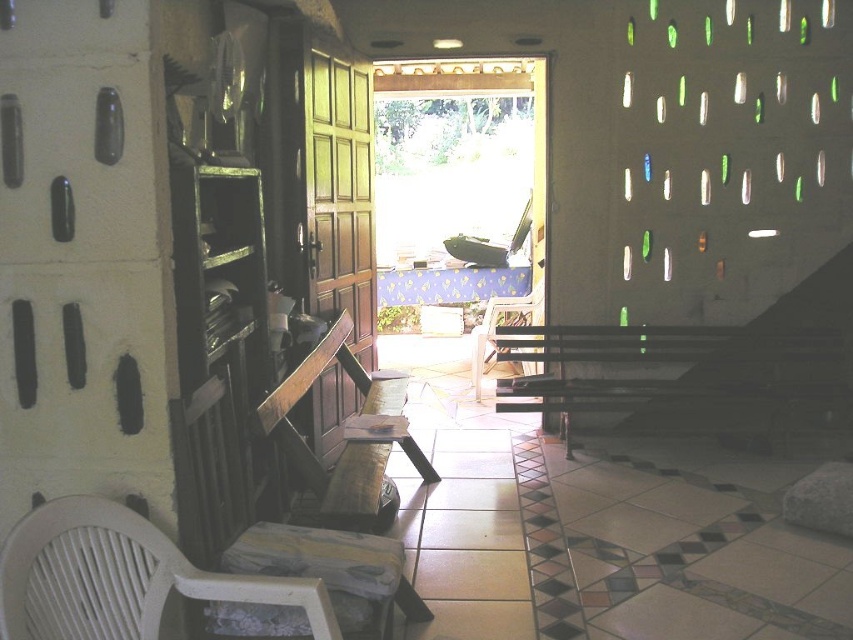
You are standing at the entrance of the room and want to sit on the wooden bench at center. Based on the coordinates provided, is the bench closer to the left wall or the right wall?

The wooden bench at center is located at point 0.683 on the x and y axis, which places it closer to the right wall than the left wall. Therefore, the bench is closer to the right wall.